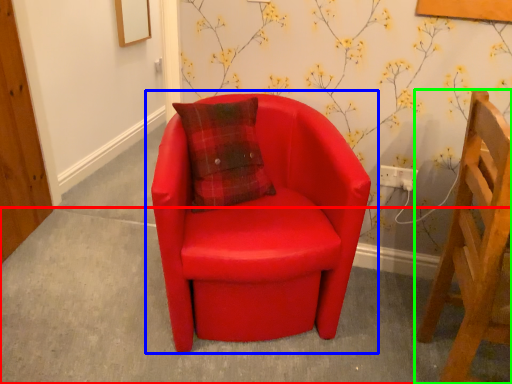
Question: Which object is positioned closest to concrete (highlighted by a red box)? Select from chair (highlighted by a blue box) and chair (highlighted by a green box).

Choices:
 (A) chair
 (B) chair

Answer: (A)